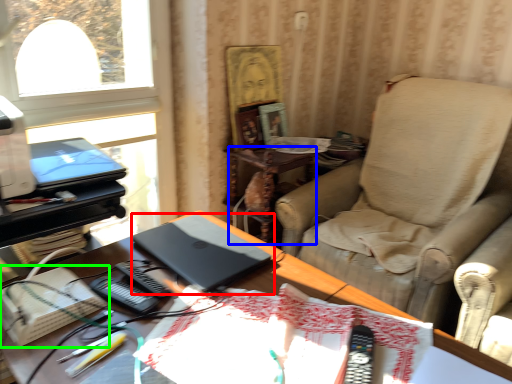
Question: Which object is the closest to the laptop (highlighted by a red box)? Choose among these: side table (highlighted by a blue box) or paperback book (highlighted by a green box).

Choices:
 (A) side table
 (B) paperback book

Answer: (B)